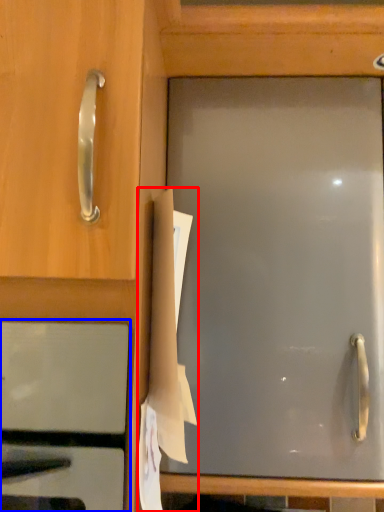
Question: Among these objects, which one is farthest to the camera, paper (highlighted by a red box) or oven (highlighted by a blue box)?

Choices:
 (A) paper
 (B) oven

Answer: (A)